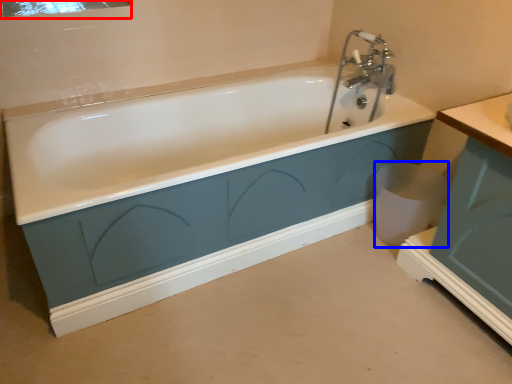
Question: Which object is further to the camera taking this photo, mirror (highlighted by a red box) or toilet bowl (highlighted by a blue box)?

Choices:
 (A) mirror
 (B) toilet bowl

Answer: (B)